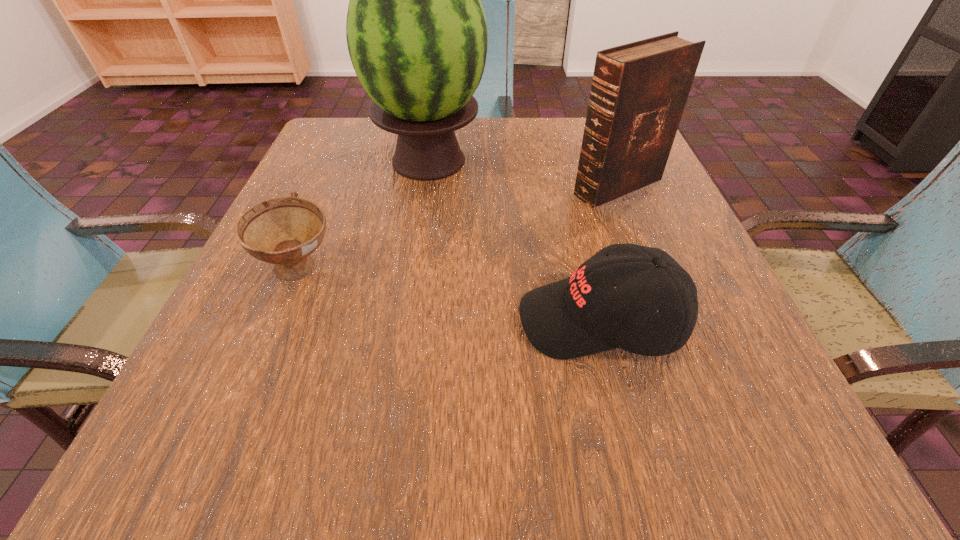
You are a GUI agent. You are given a task and a screenshot of the screen. Output one action in this format:
    pyautogui.click(x=<x>, y=<y>)
    Task: Click on the free area in between the soup bowl and the tallest object
    
    Given the screenshot: What is the action you would take?
    pyautogui.click(x=365, y=216)

In order to click on vacant space that's between the baseball cap and the watermelon in this screenshot , I will do `click(515, 241)`.

What are the coordinates of `unoccupied area between the soup bowl and the baseball cap` in the screenshot? It's located at (450, 296).

This screenshot has width=960, height=540. Find the location of `the second closest object relative to the Bible`. the second closest object relative to the Bible is located at coordinates (581, 315).

Identify which object is the second closest to the Bible. Please provide its 2D coordinates. Your answer should be formatted as a tuple, i.e. [(x, y)], where the tuple contains the x and y coordinates of a point satisfying the conditions above.

[(581, 315)]

You are a GUI agent. You are given a task and a screenshot of the screen. Output one action in this format:
    pyautogui.click(x=<x>, y=<y>)
    Task: Click on the free space that satisfies the following two spatial constraints: 1. on the back side of the watermelon; 2. on the left side of the soup bowl
    
    Given the screenshot: What is the action you would take?
    pyautogui.click(x=345, y=161)